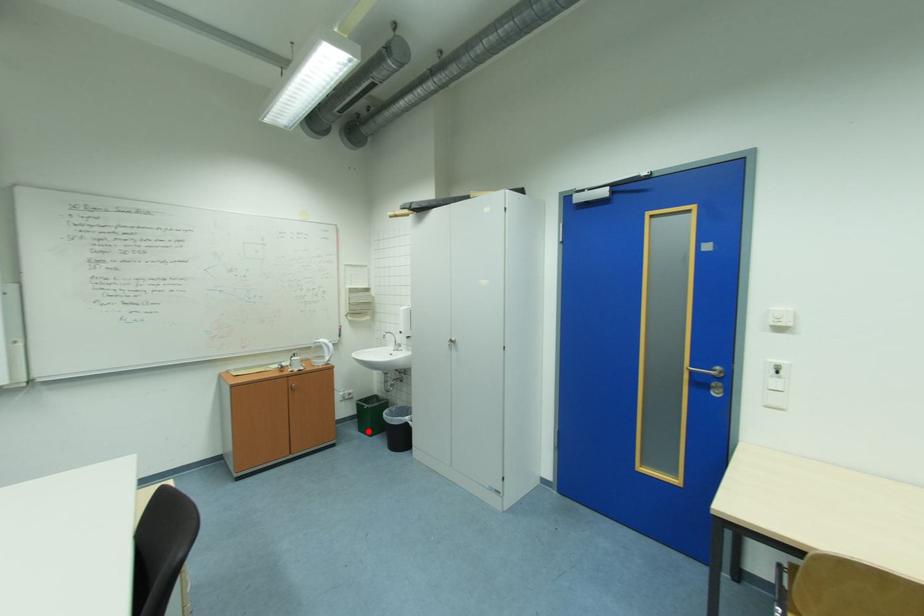
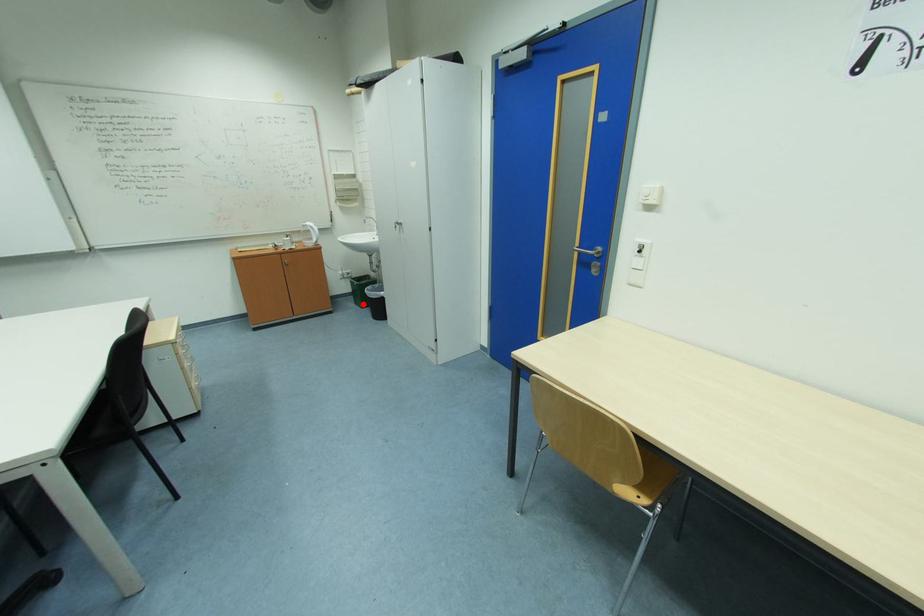
I am providing you with two images of the same scene from different viewpoints. A red point is marked on the first image and another point is marked on the second image. Are the points marked in image1 and image2 representing the same 3D position?

Yes